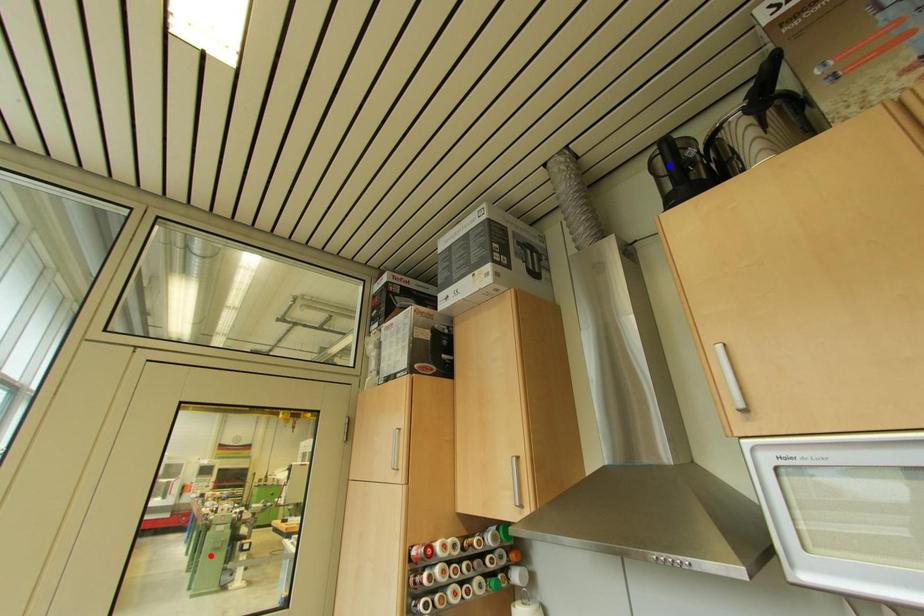
Question: Two points are marked on the image. Which point is closer to the camera?

Choices:
 (A) Blue point is closer.
 (B) Red point is closer.

Answer: (A)